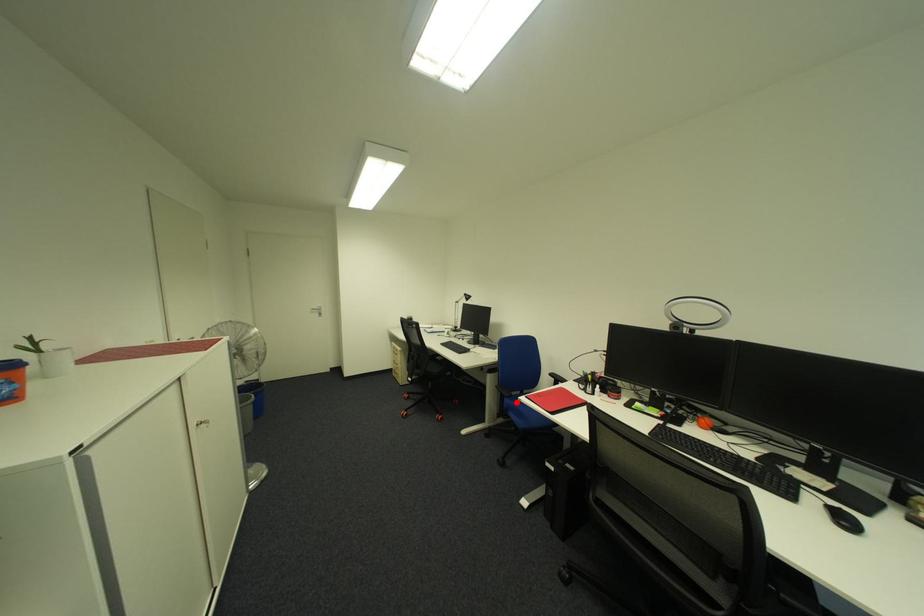
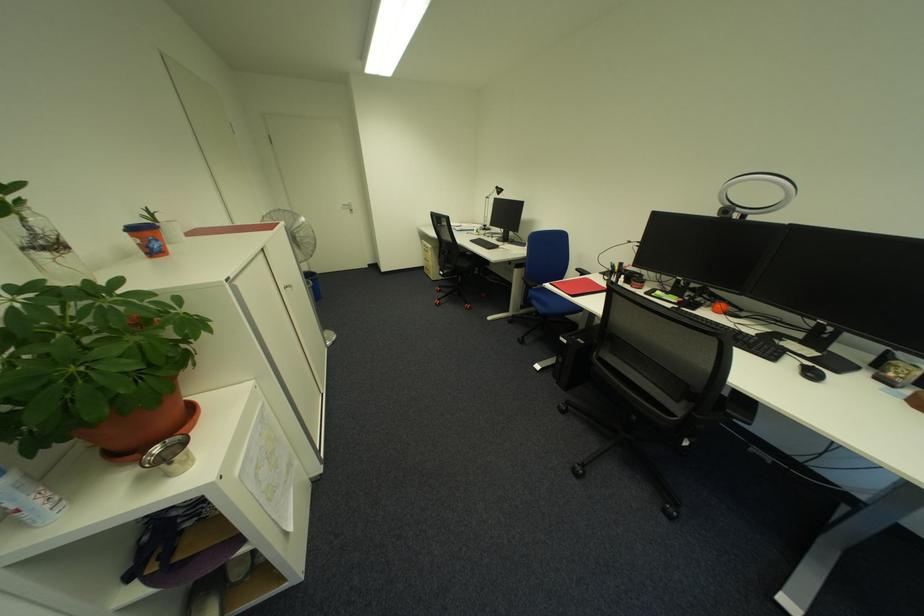
Question: A red point is marked in image1. In image2, is the corresponding 3D point closer to the camera or farther? Reply with the corresponding letter.

Choices:
 (A) The corresponding 3D point is closer.
 (B) The corresponding 3D point is farther.

Answer: (A)